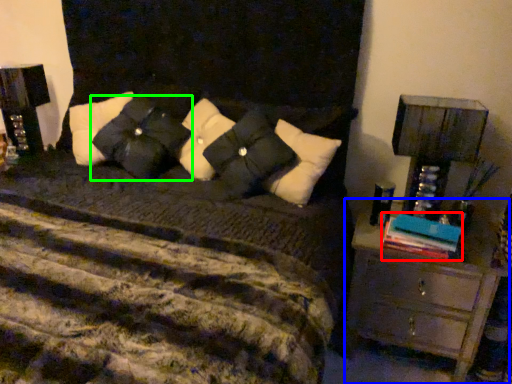
Question: Based on their relative distances, which object is nearer to book (highlighted by a red box)? Choose from chest of drawers (highlighted by a blue box) and pillow (highlighted by a green box).

Choices:
 (A) chest of drawers
 (B) pillow

Answer: (A)